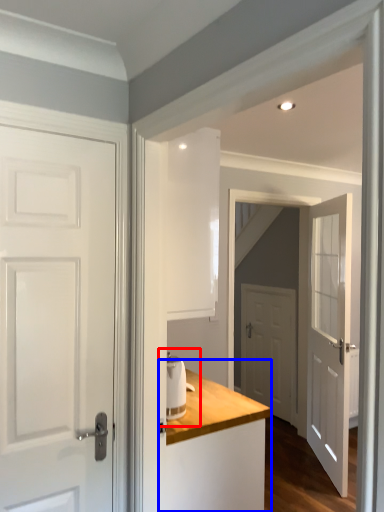
Question: Which object is further to the camera taking this photo, sink (highlighted by a red box) or dresser (highlighted by a blue box)?

Choices:
 (A) sink
 (B) dresser

Answer: (A)